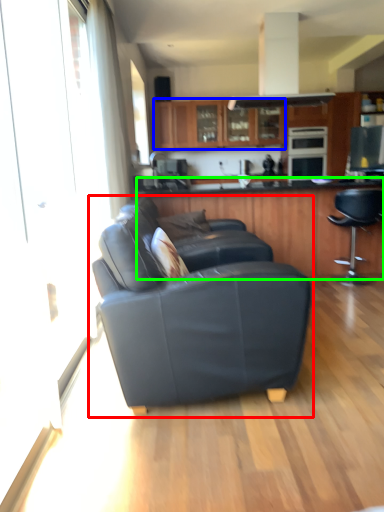
Question: Based on their relative distances, which object is farther from studio couch (highlighted by a red box)? Choose from cabinetry (highlighted by a blue box) and cabinetry (highlighted by a green box).

Choices:
 (A) cabinetry
 (B) cabinetry

Answer: (A)